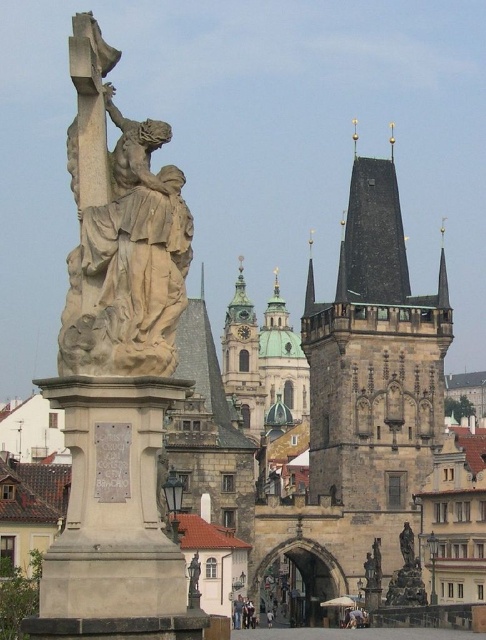
Question: Which object is closer to the camera taking this photo?

Choices:
 (A) polished bronze statue at center
 (B) polished stone tower at center right
 (C) beige stone sculpture at center

Answer: (C)

Question: Estimate the real-world distances between objects in this image. Which object is closer to the polished stone tower at center right?

Choices:
 (A) polished bronze statue at center
 (B) beige stone sculpture at center

Answer: (A)

Question: Which of these objects is positioned farthest from the beige stone sculpture at center?

Choices:
 (A) polished stone tower at center right
 (B) polished bronze statue at center

Answer: (A)

Question: Is polished stone tower at center right further to camera compared to beige stone sculpture at center?

Choices:
 (A) yes
 (B) no

Answer: (A)

Question: Where is polished stone tower at center right located in relation to beige stone sculpture at center in the image?

Choices:
 (A) above
 (B) below

Answer: (B)

Question: Does beige stone sculpture at center appear over polished bronze statue at center?

Choices:
 (A) no
 (B) yes

Answer: (B)